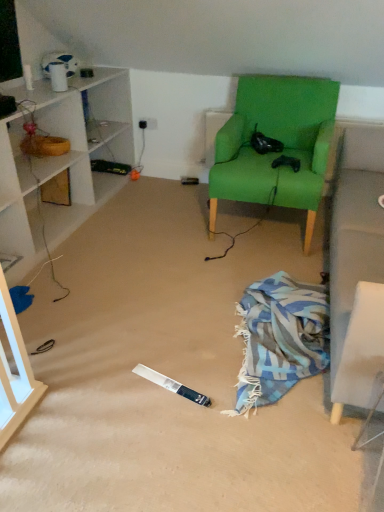
Question: Looking at their shapes, would you say blue woven blanket at lower right is wider or thinner than green fabric chair at center?

Choices:
 (A) thin
 (B) wide

Answer: (B)

Question: In terms of height, does blue woven blanket at lower right look taller or shorter compared to green fabric chair at center?

Choices:
 (A) tall
 (B) short

Answer: (B)

Question: In terms of size, does blue woven blanket at lower right appear bigger or smaller than green fabric chair at center?

Choices:
 (A) small
 (B) big

Answer: (A)

Question: In the image, is green fabric chair at center positioned in front of or behind blue woven blanket at lower right?

Choices:
 (A) behind
 (B) front

Answer: (A)

Question: From a real-world perspective, is green fabric chair at center physically located above or below blue woven blanket at lower right?

Choices:
 (A) above
 (B) below

Answer: (A)

Question: From the image's perspective, is green fabric chair at center above or below blue woven blanket at lower right?

Choices:
 (A) above
 (B) below

Answer: (A)

Question: From their relative heights in the image, would you say green fabric chair at center is taller or shorter than blue woven blanket at lower right?

Choices:
 (A) short
 (B) tall

Answer: (B)